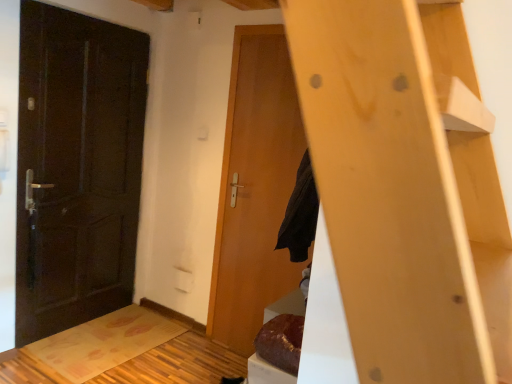
This screenshot has width=512, height=384. What are the coordinates of `blank space to the left of wooden door at center, which appears as the 2th door when viewed from the left` in the screenshot? It's located at (196, 354).